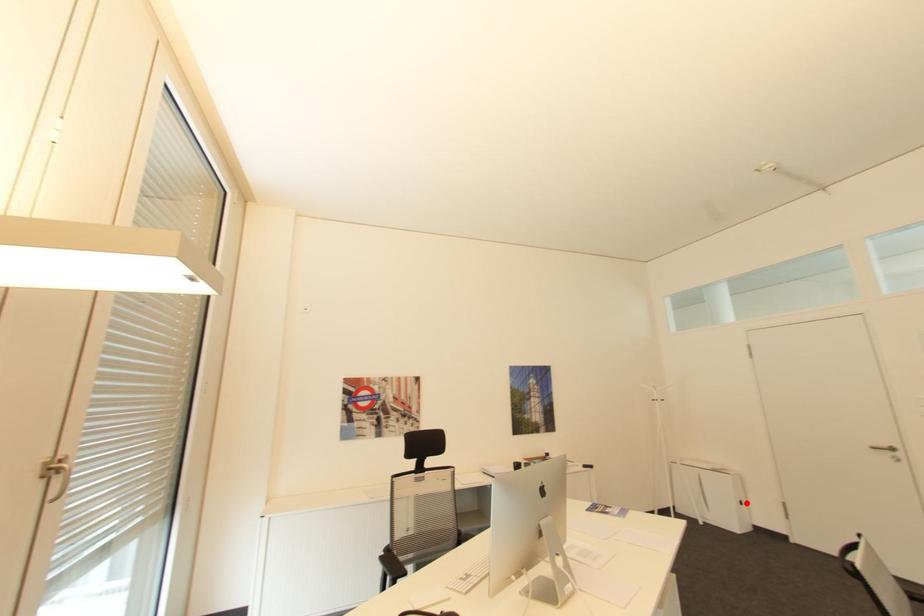
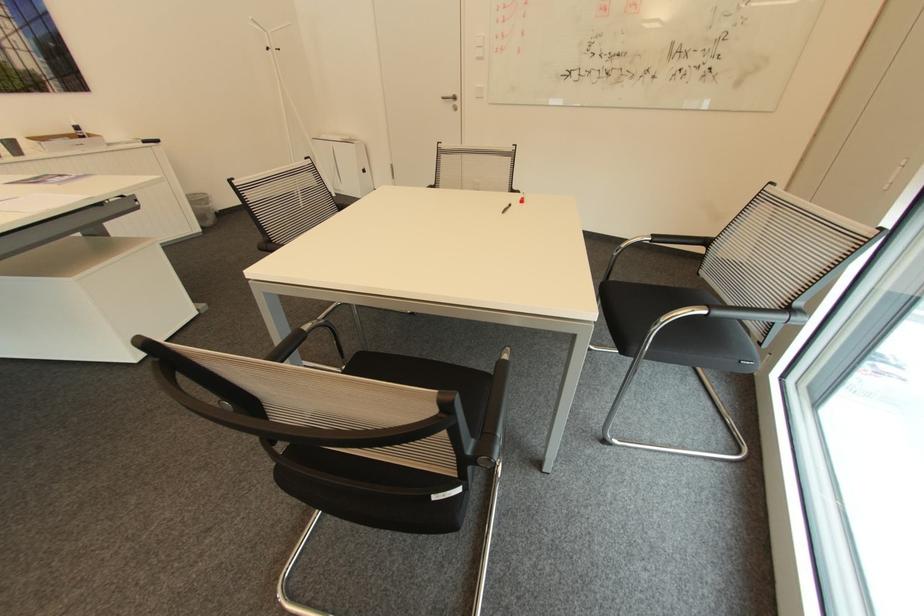
The point at the highlighted location is marked in the first image. Where is the corresponding point in the second image?

(369, 171)